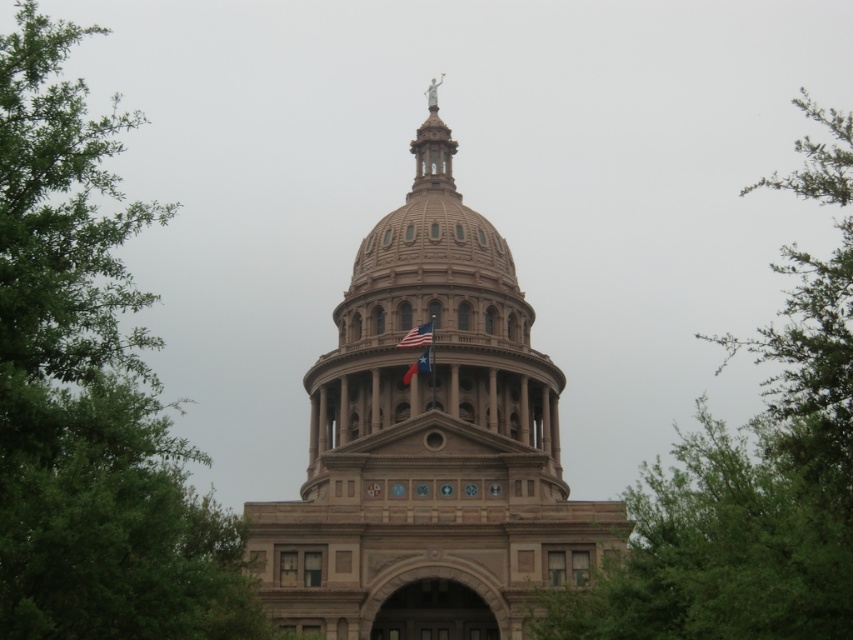
Can you confirm if brown stone dome at center is positioned to the right of brown stone flag pole at center?

Correct, you'll find brown stone dome at center to the right of brown stone flag pole at center.

The image size is (853, 640). I want to click on brown stone dome at center, so click(428, 444).

Does brown stone dome at center have a lesser height compared to green leafy tree at upper right?

Indeed, brown stone dome at center has a lesser height compared to green leafy tree at upper right.

Can you confirm if brown stone dome at center is positioned to the left of green leafy tree at upper right?

Yes, brown stone dome at center is to the left of green leafy tree at upper right.

Image resolution: width=853 pixels, height=640 pixels. What do you see at coordinates (428, 444) in the screenshot?
I see `brown stone dome at center` at bounding box center [428, 444].

Identify the location of brown stone dome at center. (428, 444).

Does brown stone dome at center appear on the right side of green leafy tree at upper left?

Yes, brown stone dome at center is to the right of green leafy tree at upper left.

Does point (258, 560) lie behind point (0, 531)?

Yes, point (258, 560) is behind point (0, 531).

Locate an element on the screen. The height and width of the screenshot is (640, 853). brown stone dome at center is located at coordinates (428, 444).